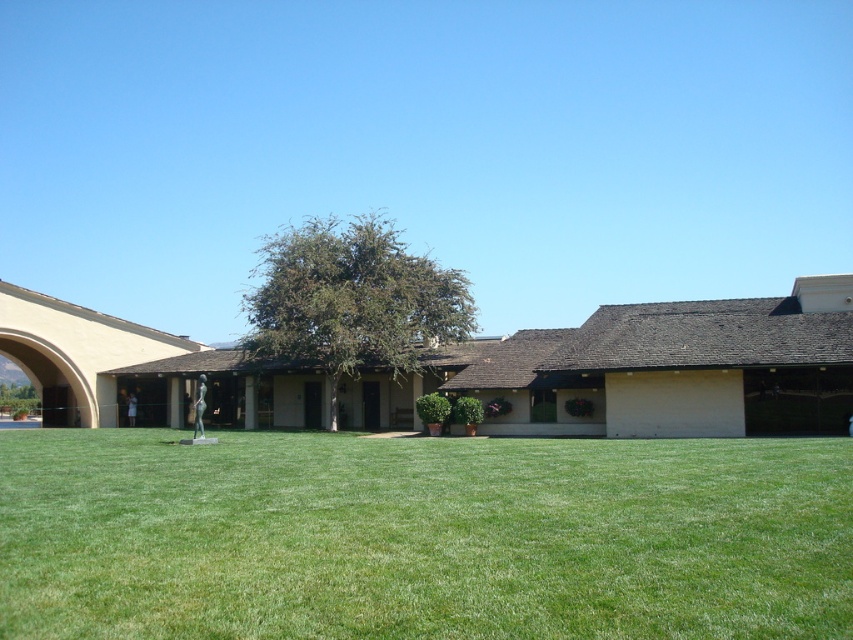
Does green grass at center come behind green leafy tree at center?

No, it is not.

Measure the distance between green grass at center and green leafy tree at center.

green grass at center is 29.44 meters from green leafy tree at center.

Which is in front, point (273, 506) or point (267, 285)?

Point (273, 506)

Identify the location of green grass at center. Image resolution: width=853 pixels, height=640 pixels. [422, 536].